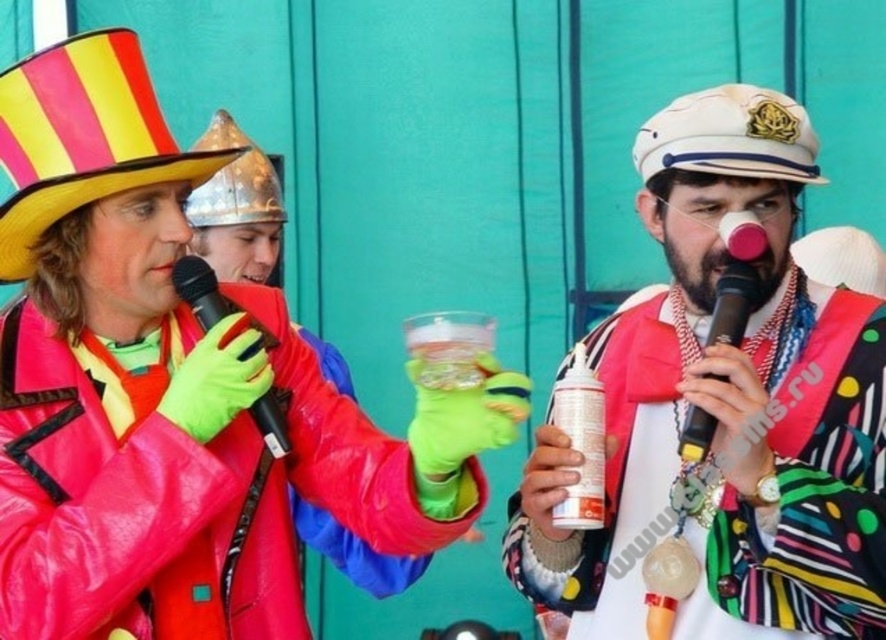
Question: Is polka dot fabric scarf at center closer to the viewer compared to rubberized red jacket at left?

Choices:
 (A) no
 (B) yes

Answer: (B)

Question: Which point is farther to the camera?

Choices:
 (A) white matte can at center
 (B) black matte microphone at center
 (C) rubber glove at left
 (D) polka dot fabric scarf at center

Answer: (A)

Question: Which object appears farthest from the camera in this image?

Choices:
 (A) polka dot fabric scarf at center
 (B) black matte microphone at center
 (C) white matte can at center

Answer: (C)

Question: Is the position of polka dot fabric scarf at center less distant than that of rubberized red jacket at left?

Choices:
 (A) no
 (B) yes

Answer: (B)

Question: Can you confirm if polka dot fabric scarf at center is smaller than black matte microphone at center?

Choices:
 (A) yes
 (B) no

Answer: (B)

Question: Which object is the closest to the polka dot fabric scarf at center?

Choices:
 (A) white matte can at center
 (B) rubberized red jacket at left
 (C) black plastic microphone at center
 (D) black matte microphone at center

Answer: (A)